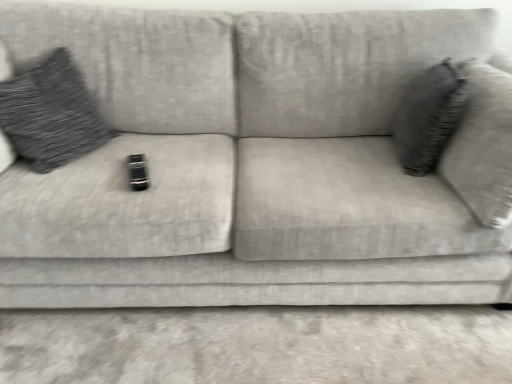
Question: In the image, is textured gray pillow at right, acting as the first throw pillow starting from the right, positioned in front of or behind textured gray pillow at left, which appears as the 1th throw pillow when viewed from the left?

Choices:
 (A) behind
 (B) front

Answer: (A)

Question: From the image's perspective, relative to textured gray pillow at left, which is the second throw pillow in right-to-left order, is textured gray pillow at right, placed as the second throw pillow when sorted from left to right, above or below?

Choices:
 (A) below
 (B) above

Answer: (A)

Question: Considering the positions of textured gray pillow at right, acting as the first throw pillow starting from the right, and textured gray pillow at left, which is the second throw pillow in right-to-left order, in the image, is textured gray pillow at right, acting as the first throw pillow starting from the right, bigger or smaller than textured gray pillow at left, which is the second throw pillow in right-to-left order,?

Choices:
 (A) big
 (B) small

Answer: (B)

Question: Looking at the image, does textured gray pillow at left, which appears as the 1th throw pillow when viewed from the left, seem bigger or smaller compared to textured gray pillow at right, acting as the first throw pillow starting from the right?

Choices:
 (A) big
 (B) small

Answer: (A)

Question: Is point (60, 56) closer or farther from the camera than point (408, 173)?

Choices:
 (A) farther
 (B) closer

Answer: (A)

Question: Would you say textured gray pillow at left, which appears as the 1th throw pillow when viewed from the left, is to the left or to the right of textured gray pillow at right, acting as the first throw pillow starting from the right, in the picture?

Choices:
 (A) left
 (B) right

Answer: (A)

Question: From a real-world perspective, is textured gray pillow at left, which appears as the 1th throw pillow when viewed from the left, above or below textured gray pillow at right, acting as the first throw pillow starting from the right?

Choices:
 (A) above
 (B) below

Answer: (B)